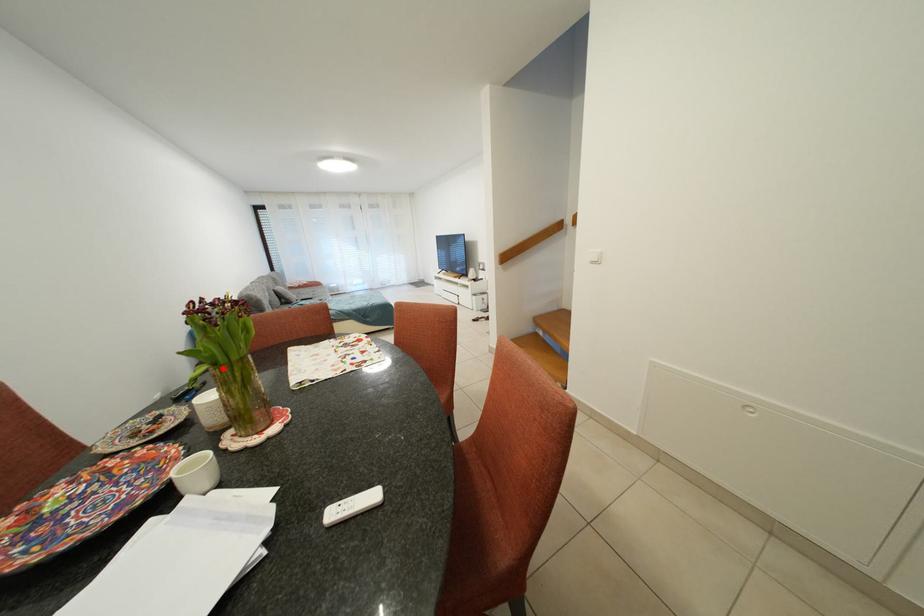
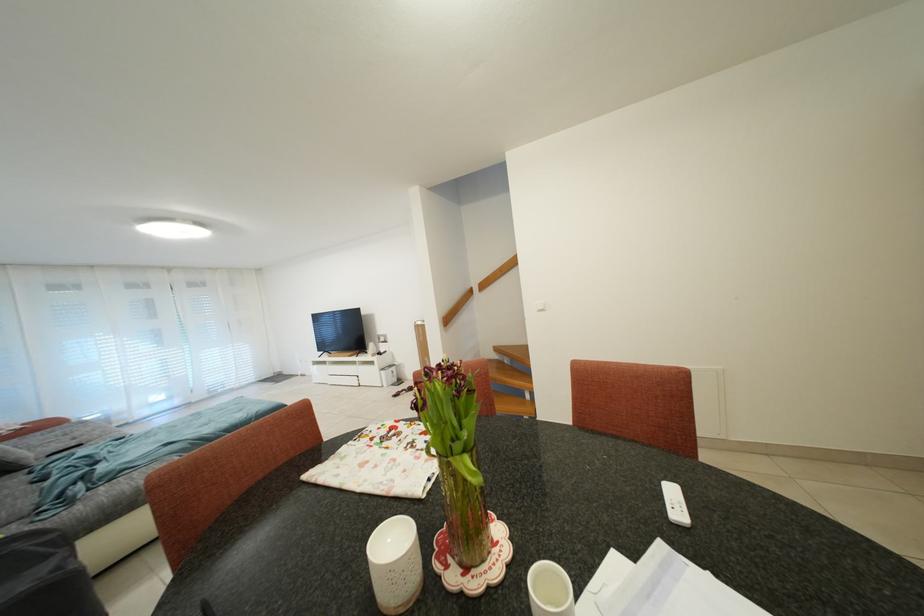
The point at the highlighted location is marked in the first image. Where is the corresponding point in the second image?

(472, 455)